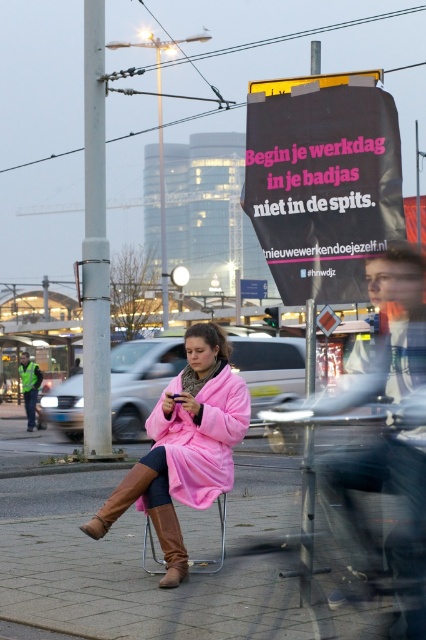
Question: Is pink matte trench coat at center positioned at the back of pink velvety coat at center?

Choices:
 (A) no
 (B) yes

Answer: (A)

Question: Which of the following is the farthest from the observer?

Choices:
 (A) pink matte trench coat at center
 (B) brown suede boot at lower center

Answer: (B)

Question: Which point is closer to the camera taking this photo?

Choices:
 (A) (308, 170)
 (B) (348, 392)
 (C) (186, 576)

Answer: (B)

Question: Estimate the real-world distances between objects in this image. Which object is farther from the brown leather boot at lower center?

Choices:
 (A) brown suede boot at lower center
 (B) black matte sign at upper center
 (C) pink matte trench coat at center

Answer: (C)

Question: From the image, what is the correct spatial relationship of black matte sign at upper center in relation to pink velvety coat at center?

Choices:
 (A) right
 (B) left

Answer: (A)

Question: Does brown leather boot at lower center have a smaller size compared to brown suede boot at lower center?

Choices:
 (A) yes
 (B) no

Answer: (B)